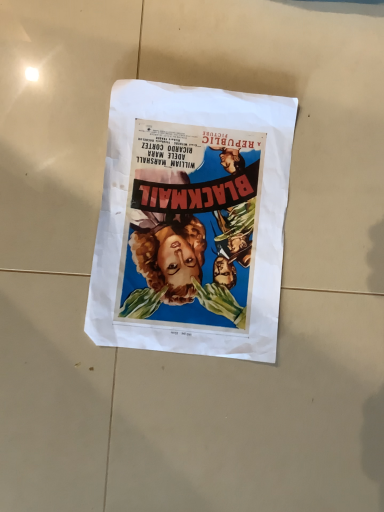
Locate an element on the screen. free space above matte paper poster at center (from a real-world perspective) is located at coordinates (195, 205).